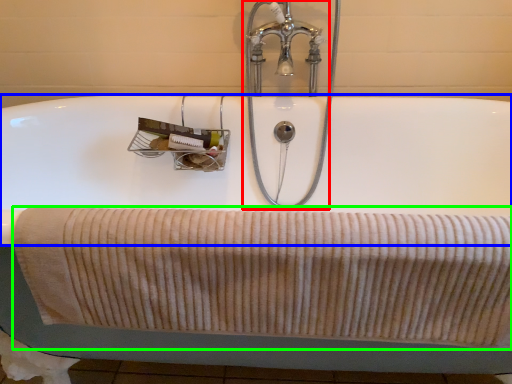
Question: Which object is positioned closest to tap (highlighted by a red box)? Select from bath (highlighted by a blue box) and bath towel (highlighted by a green box).

Choices:
 (A) bath
 (B) bath towel

Answer: (A)